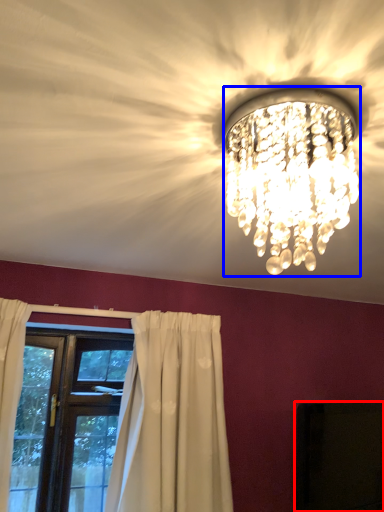
Question: Which point is closer to the camera, dark (highlighted by a red box) or lamp (highlighted by a blue box)?

Choices:
 (A) dark
 (B) lamp

Answer: (B)